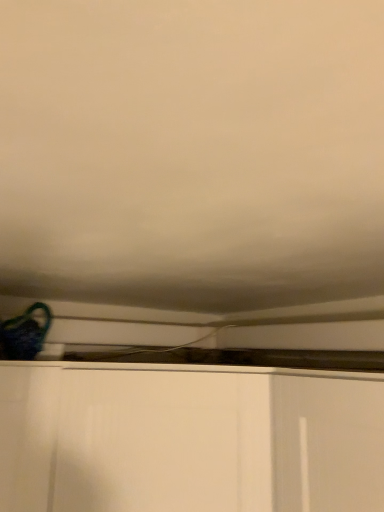
Describe the element at coordinates (189, 438) in the screenshot. The image size is (384, 512). I see `white glossy door at lower center` at that location.

The image size is (384, 512). In order to click on white glossy door at lower center in this screenshot , I will do `click(189, 438)`.

At what (x,y) coordinates should I click in order to perform the action: click on white glossy door at lower center. Please return your answer as a coordinate pair (x, y). Looking at the image, I should click on click(x=189, y=438).